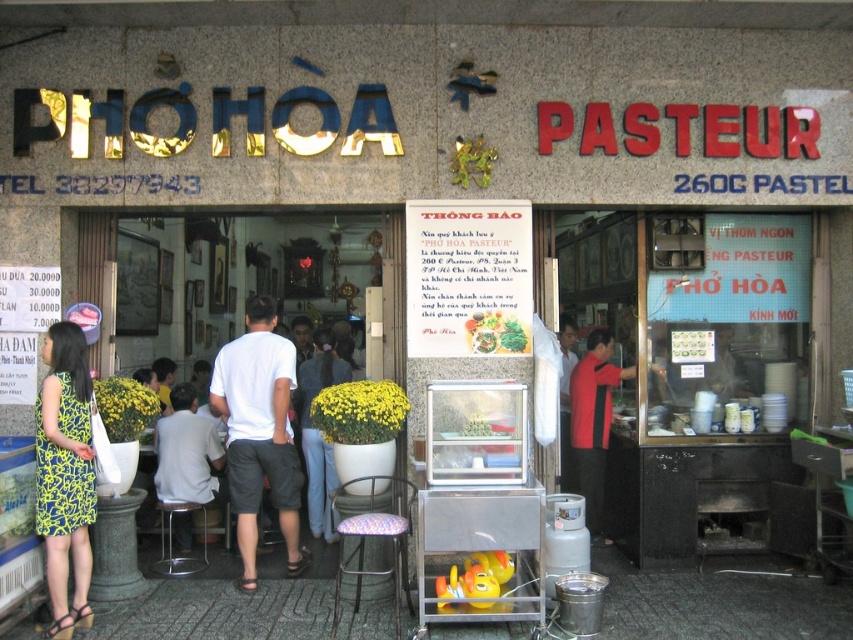
You are a delivery person standing outside the Pho Hoa restaurant. You need to place a delivery bag on the ground between the white cotton shirt at center and the metallic stool at lower center. Can you fit the bag there if it requires at least 3 feet of space?

The white cotton shirt at center and metallic stool at lower center are 34.66 inches apart from each other. Since 34.66 inches is approximately 2.89 feet, which is less than the required 3 feet, the delivery bag cannot be placed there.

Looking at this image, you are a delivery person standing at the entrance of Pho Hoa Pasteur restaurant. You need to deliver a package to the person wearing a white cotton shirt at center and a white fabric shirt at center. The package can only be given to the person who is closer to the entrance. Which shirt should you approach?

The white cotton shirt at center is closer to the entrance than the white fabric shirt at center because the distance between them is 35.54 inches, so you should approach the white cotton shirt at center.